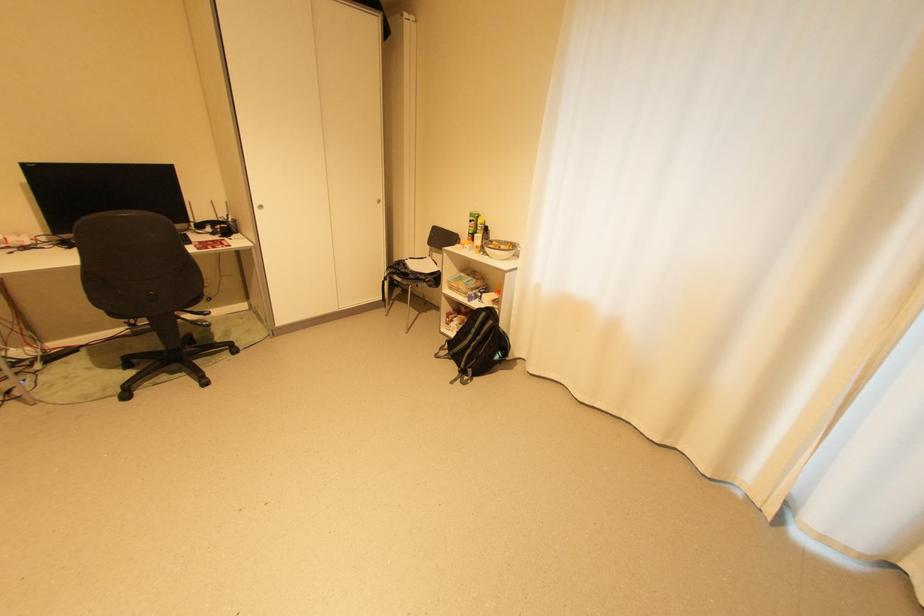
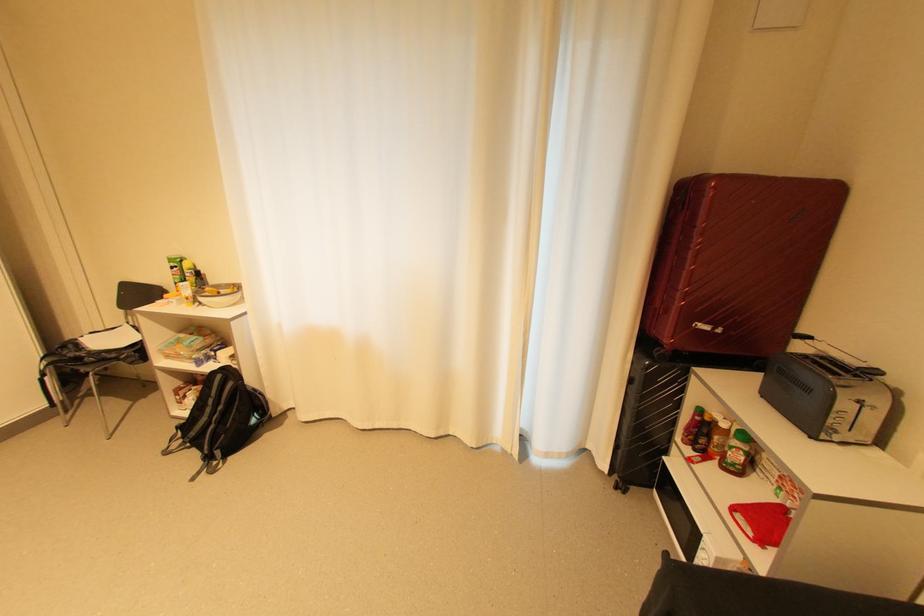
Find the pixel in the second image that matches point (492, 314) in the first image.

(226, 377)